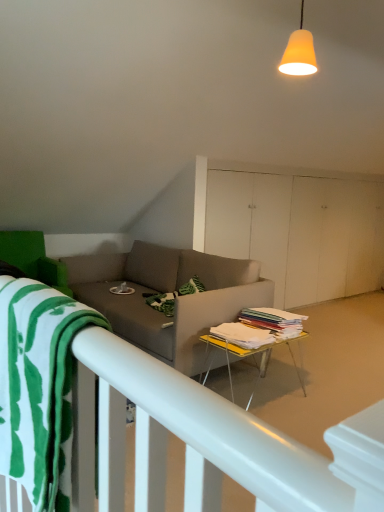
Question: Is white matte bed frame at lower left to the right of yellow plastic table at center from the viewer's perspective?

Choices:
 (A) yes
 (B) no

Answer: (A)

Question: From the image's perspective, is white matte bed frame at lower left located beneath yellow plastic table at center?

Choices:
 (A) no
 (B) yes

Answer: (B)

Question: Is white matte bed frame at lower left to the left of yellow plastic table at center from the viewer's perspective?

Choices:
 (A) no
 (B) yes

Answer: (A)

Question: From the image's perspective, is white matte bed frame at lower left over yellow plastic table at center?

Choices:
 (A) yes
 (B) no

Answer: (B)

Question: Is there a large distance between white matte bed frame at lower left and yellow plastic table at center?

Choices:
 (A) no
 (B) yes

Answer: (B)

Question: Is green cotton beach towel at lower left wider or thinner than orange matte lampshade at upper center?

Choices:
 (A) thin
 (B) wide

Answer: (B)

Question: Based on their positions, is green cotton beach towel at lower left located to the left or right of orange matte lampshade at upper center?

Choices:
 (A) right
 (B) left

Answer: (B)

Question: From the image's perspective, is green cotton beach towel at lower left above or below orange matte lampshade at upper center?

Choices:
 (A) above
 (B) below

Answer: (B)

Question: Is green cotton beach towel at lower left bigger or smaller than orange matte lampshade at upper center?

Choices:
 (A) big
 (B) small

Answer: (A)

Question: Does point (87, 488) appear closer or farther from the camera than point (64, 426)?

Choices:
 (A) closer
 (B) farther

Answer: (B)

Question: From the image's perspective, is white matte bed frame at lower left above or below green cotton beach towel at lower left?

Choices:
 (A) above
 (B) below

Answer: (B)

Question: From a real-world perspective, is white matte bed frame at lower left above or below green cotton beach towel at lower left?

Choices:
 (A) below
 (B) above

Answer: (A)

Question: Is white matte bed frame at lower left in front of or behind green cotton beach towel at lower left in the image?

Choices:
 (A) behind
 (B) front

Answer: (A)

Question: Considering the positions of orange matte lampshade at upper center and yellow plastic table at center in the image, is orange matte lampshade at upper center taller or shorter than yellow plastic table at center?

Choices:
 (A) short
 (B) tall

Answer: (A)

Question: From the image's perspective, is orange matte lampshade at upper center above or below yellow plastic table at center?

Choices:
 (A) below
 (B) above

Answer: (B)